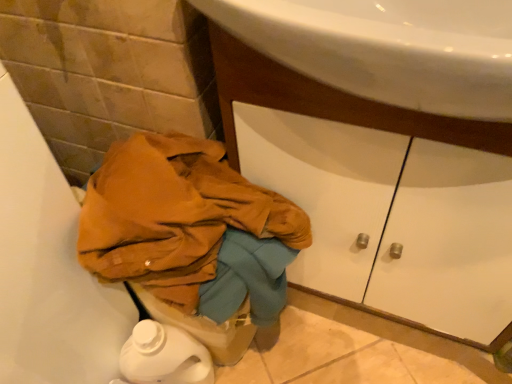
Question: Is white matte drawer at center taller or shorter than matte orange fabric at lower left?

Choices:
 (A) short
 (B) tall

Answer: (A)

Question: In the image, is white matte drawer at center positioned in front of or behind matte orange fabric at lower left?

Choices:
 (A) front
 (B) behind

Answer: (B)

Question: Considering the positions of point (492, 276) and point (74, 377), is point (492, 276) closer or farther from the camera than point (74, 377)?

Choices:
 (A) closer
 (B) farther

Answer: (A)

Question: From the image's perspective, is matte orange fabric at lower left located above or below white matte drawer at center?

Choices:
 (A) above
 (B) below

Answer: (B)

Question: From their relative heights in the image, would you say matte orange fabric at lower left is taller or shorter than white matte drawer at center?

Choices:
 (A) short
 (B) tall

Answer: (B)

Question: Is matte orange fabric at lower left to the left or to the right of white matte drawer at center in the image?

Choices:
 (A) right
 (B) left

Answer: (B)

Question: From a real-world perspective, is matte orange fabric at lower left above or below white matte drawer at center?

Choices:
 (A) below
 (B) above

Answer: (A)